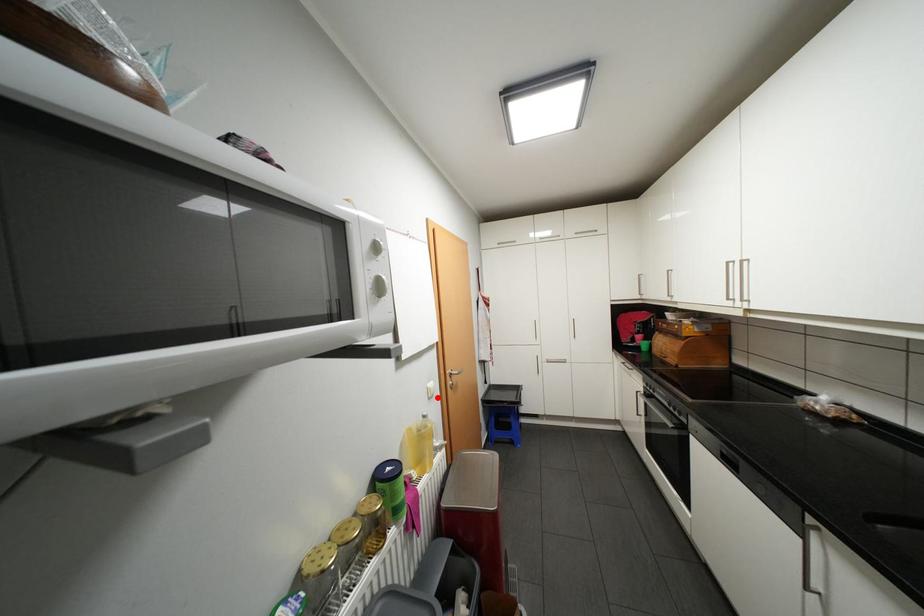
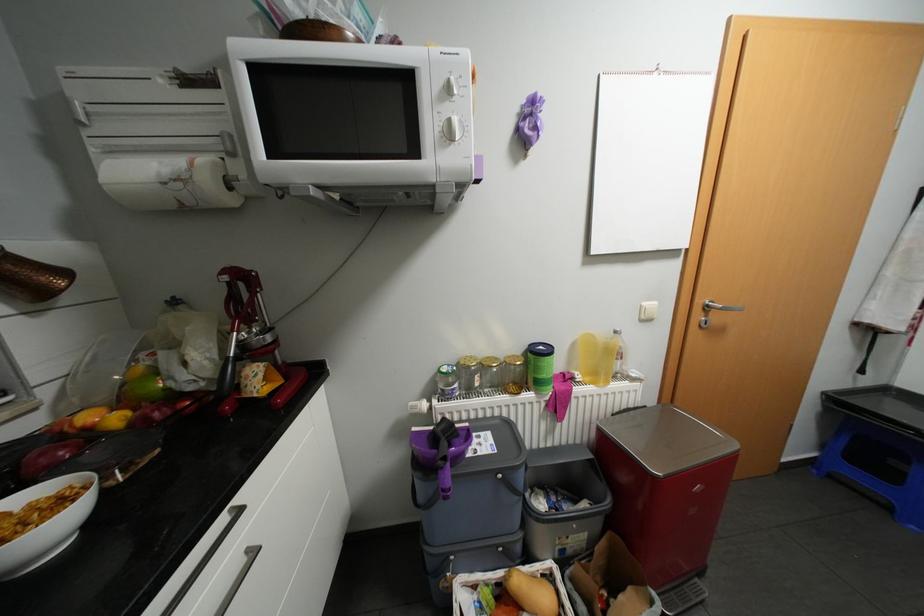
Where in the second image is the point corresponding to the highlighted location from the first image?

(649, 320)